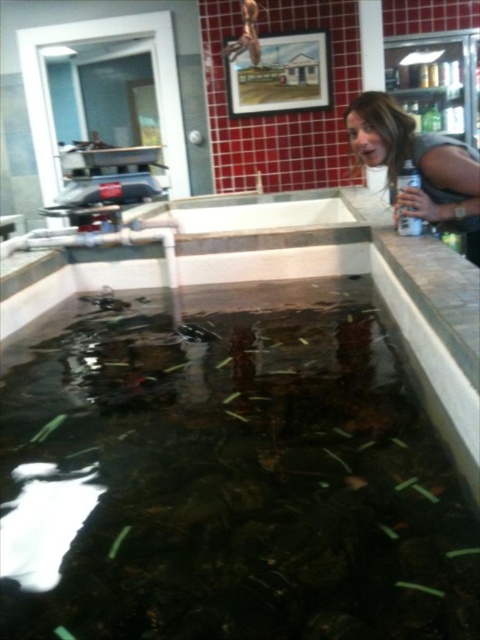
You are a customer in the store and want to see the blonde hair at upper right while also looking at the translucent glass tank at center. Can you do this without moving your head?

The translucent glass tank at center is below blonde hair at upper right, so you can look at both by tilting your head slightly without moving it sideways.

You are a customer in the store and want to look at the translucent glass tank at center and the blonde hair at upper right. Which object can you see more clearly from your current position?

The translucent glass tank at center is closer to the viewer than blonde hair at upper right, so you can see the translucent glass tank at center more clearly.

You are standing in the pet store and want to find the translucent glass tank at center. According to the coordinates provided, where should you look to locate it?

The translucent glass tank at center is located at coordinates point [228,477].